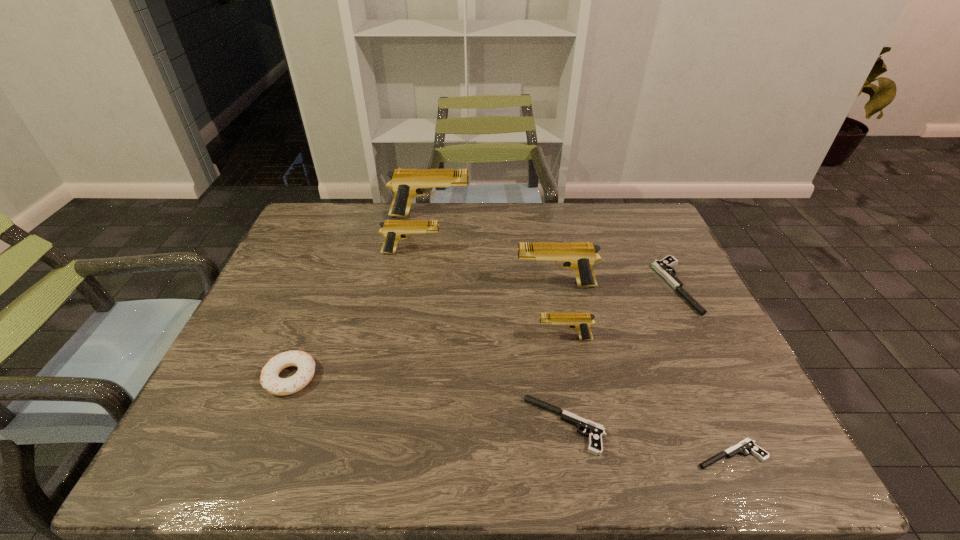
I want to click on the tallest object, so click(x=406, y=183).

Where is `the farthest object`? the farthest object is located at coordinates (406, 183).

Where is `the third smallest tan pistol`? the third smallest tan pistol is located at coordinates (579, 256).

Locate an element on the screen. This screenshot has width=960, height=540. the second tallest pistol is located at coordinates (579, 256).

The image size is (960, 540). Find the location of `the second farthest object`. the second farthest object is located at coordinates (393, 230).

The height and width of the screenshot is (540, 960). I want to click on the third biggest tan pistol, so click(393, 230).

Identify the location of the fourth shortest pistol. This screenshot has height=540, width=960. (581, 322).

Locate an element on the screen. the nearest tan pistol is located at coordinates (581, 322).

Locate an element on the screen. The image size is (960, 540). the fourth shortest object is located at coordinates (269, 379).

Find the location of a particular element. This screenshot has width=960, height=540. white doughnut is located at coordinates (269, 379).